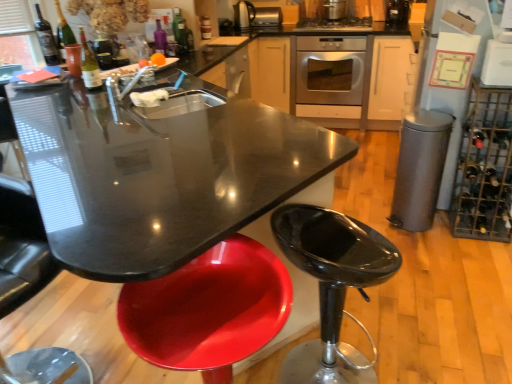
Question: From the image's perspective, relative to stainless steel oven at center, is metallic wire wine rack at right above or below?

Choices:
 (A) below
 (B) above

Answer: (A)

Question: Choose the correct answer: Is metallic wire wine rack at right inside stainless steel oven at center or outside it?

Choices:
 (A) inside
 (B) outside

Answer: (B)

Question: Based on their relative distances, which object is nearer to the white glossy refrigerator at upper right, which is the 5th appliance in back-to-front order?

Choices:
 (A) matte glass wine bottle at upper left, which is the second wine bottle from back to front
 (B) matte glass bottle at upper left, acting as the 3th bottle starting from the right
 (C) metallic stainless steel toaster at upper center, which is the fourth appliance from right to left
 (D) matte black wine bottle at upper left, which is counted as the third wine bottle, starting from the back
 (E) stainless steel oven at center

Answer: (E)

Question: Considering the real-world distances, which object is closest to the matte black wine bottle at upper left, which ranks as the 3th wine bottle in right-to-left order?

Choices:
 (A) matte glass bottle at upper left, the first bottle positioned from the left
 (B) stainless steel oven at center
 (C) metallic wire wine rack at right
 (D) metallic gray trash can at right, marked as the 1th appliance in a bottom-to-top arrangement
 (E) white glossy refrigerator at upper right, which appears as the 1th appliance when viewed from the right

Answer: (A)